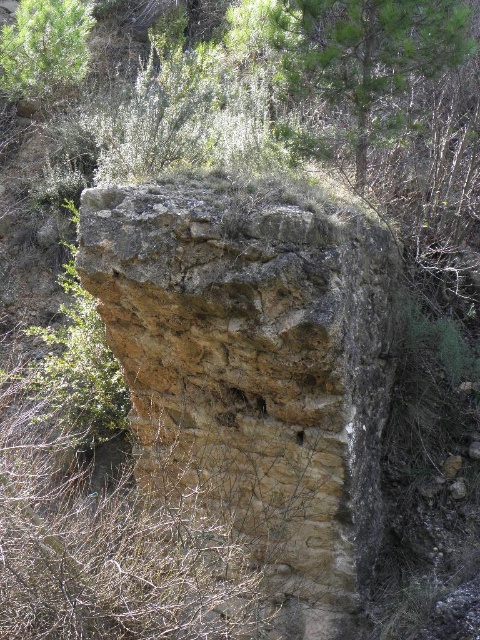
Question: Does green leafy tree at upper center have a smaller size compared to green leafy tree at upper left?

Choices:
 (A) yes
 (B) no

Answer: (B)

Question: Considering the real-world distances, which object is farthest from the green leafy tree at upper left?

Choices:
 (A) brown rough stone at center
 (B) green leafy tree at upper center

Answer: (A)

Question: Which object appears closest to the camera in this image?

Choices:
 (A) green leafy tree at upper center
 (B) brown rough stone at center

Answer: (B)

Question: Is brown rough stone at center wider than green leafy tree at upper left?

Choices:
 (A) yes
 (B) no

Answer: (A)

Question: Which object is the closest to the brown rough stone at center?

Choices:
 (A) green leafy tree at upper left
 (B) green leafy tree at upper center

Answer: (B)

Question: Is brown rough stone at center smaller than green leafy tree at upper center?

Choices:
 (A) no
 (B) yes

Answer: (A)